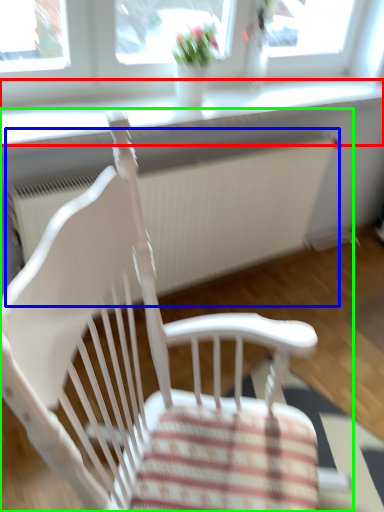
Question: Considering the real-world distances, which object is closest to window sill (highlighted by a red box)? radiator (highlighted by a blue box) or chair (highlighted by a green box).

Choices:
 (A) radiator
 (B) chair

Answer: (A)